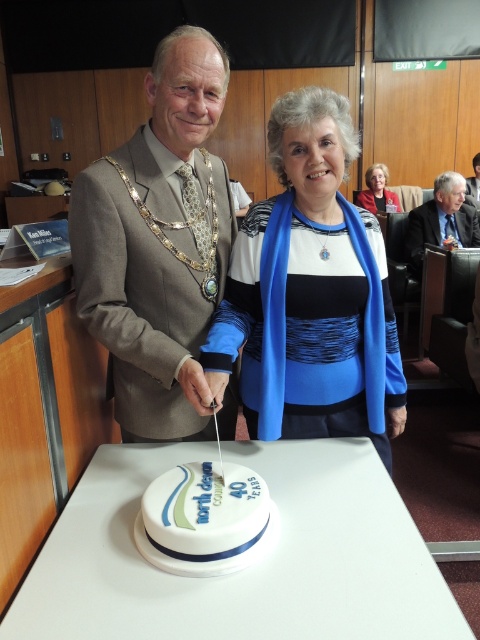
You are an architect designing a new council building and need to determine the spatial relationship between two points on a blueprint. The points are labeled as point 1 at coordinates point (x=441, y=232) and point 2 at coordinates point (x=477, y=166). Based on the image provided, which point is closer to the viewer?

Point (x=441, y=232) is closer to the viewer than point (x=477, y=166).

You are a photographer at the event and need to position yourself so that the blue fabric at center and the gray suit at center are both visible in the frame. Based on their positions, which object should you place closer to the left side of your camera view?

The blue fabric at center is to the left of gray suit at center, so you should place the blue fabric at center closer to the left side of your camera view.

You are attending a council anniversary event and see the blue fabric at center and the gray suit at center. Which one is positioned lower in the image?

The blue fabric at center is below gray suit at center, so the blue fabric at center is positioned lower in the image.